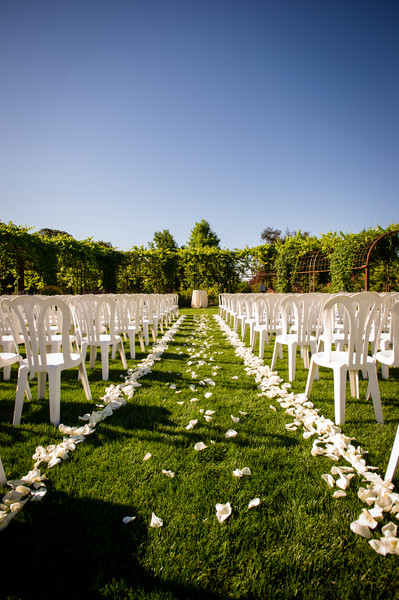
This screenshot has width=399, height=600. In order to click on line of flowers next chairs in this screenshot , I will do `click(129, 384)`, `click(278, 388)`.